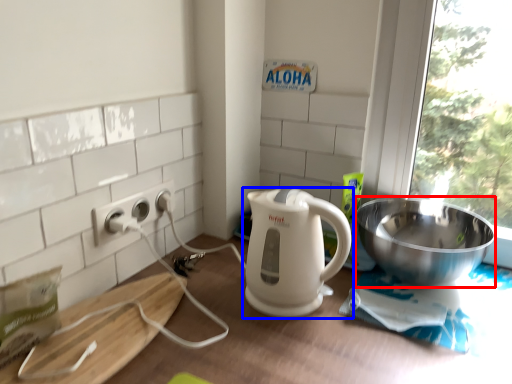
Question: Which object is closer to the camera taking this photo, bowl (highlighted by a red box) or kitchen appliance (highlighted by a blue box)?

Choices:
 (A) bowl
 (B) kitchen appliance

Answer: (B)